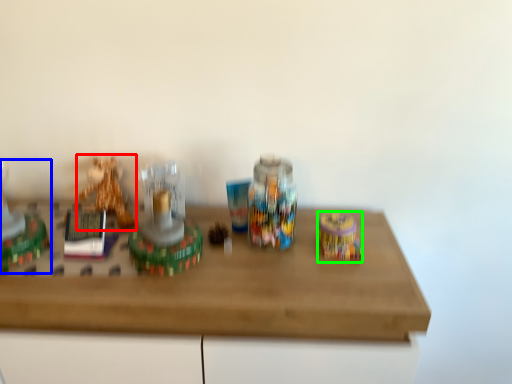
Question: Considering the real-world distances, which object is closest to toy (highlighted by a red box)? toy (highlighted by a blue box) or toy (highlighted by a green box).

Choices:
 (A) toy
 (B) toy

Answer: (A)